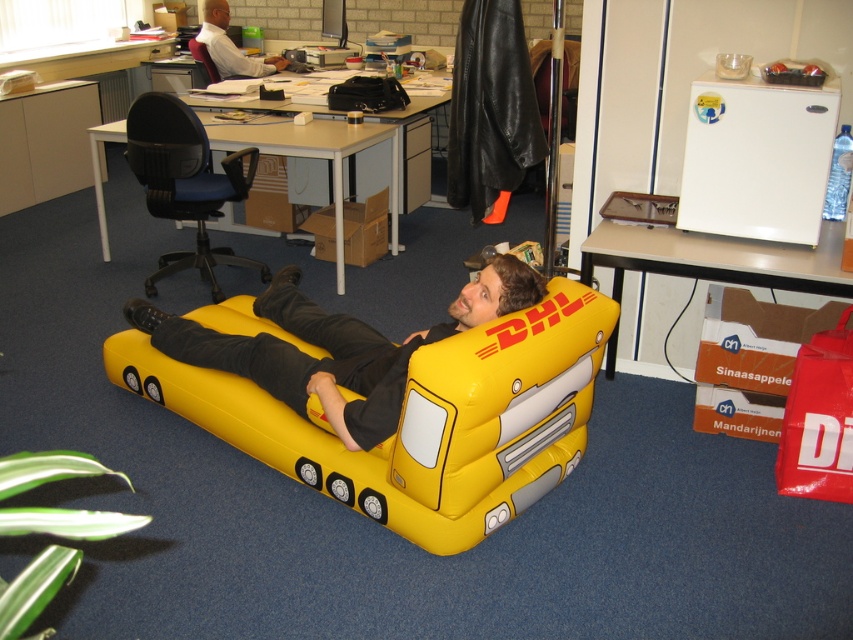
Question: Which of the following is the closest to the observer?

Choices:
 (A) (195, 40)
 (B) (302, 353)
 (C) (155, 109)

Answer: (B)

Question: Is white plastic computer desk at lower right to the left of smooth black office chair at upper left from the viewer's perspective?

Choices:
 (A) no
 (B) yes

Answer: (A)

Question: Considering the real-world distances, which object is closest to the matte white desk at center?

Choices:
 (A) smooth black office chair at upper left
 (B) white plastic computer desk at lower right
 (C) yellow fabric bean bag chair at center
 (D) yellow matte/inflatable truck at center

Answer: (C)

Question: Can you confirm if matte white desk at center is positioned above smooth black office chair at upper left?

Choices:
 (A) yes
 (B) no

Answer: (B)

Question: Does yellow fabric bean bag chair at center lie behind matte white desk at center?

Choices:
 (A) no
 (B) yes

Answer: (A)

Question: Among these objects, which one is nearest to the camera?

Choices:
 (A) smooth black office chair at upper left
 (B) yellow matte/inflatable truck at center
 (C) white shirt at upper left

Answer: (B)